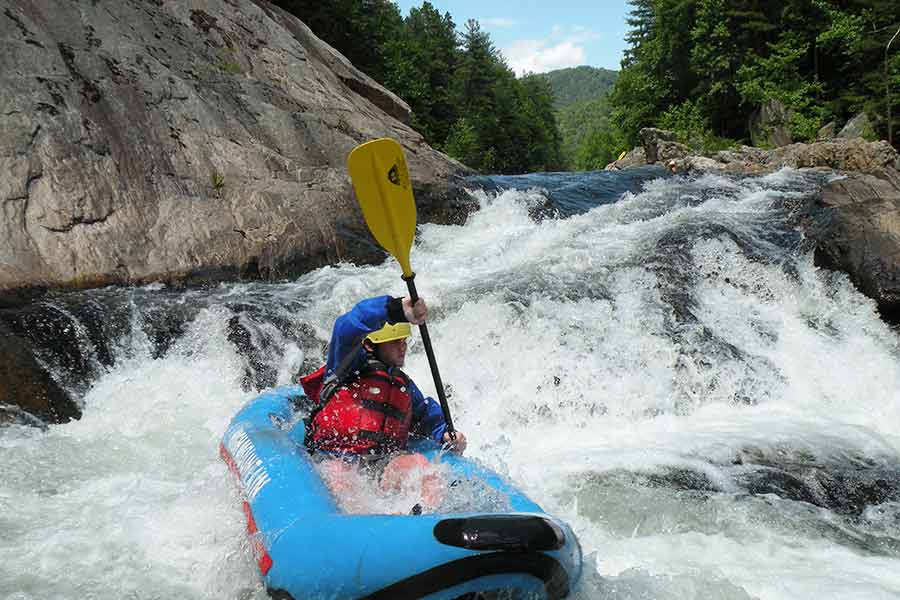
Where is `paddle handle`? paddle handle is located at coordinates (429, 357).